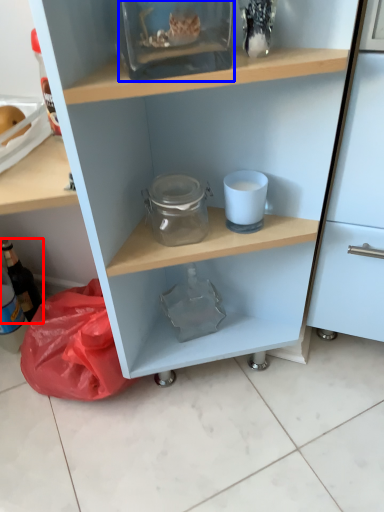
Question: Which point is further to the camera, bottle (highlighted by a red box) or glass box (highlighted by a blue box)?

Choices:
 (A) bottle
 (B) glass box

Answer: (A)